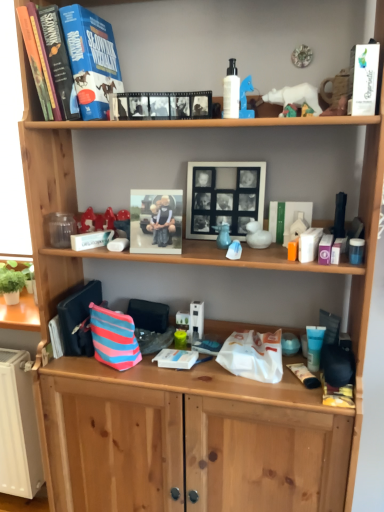
Question: Does hardcover book at upper left, positioned as the second paperback book in front-to-back order, lie behind matte plastic photo frame at center, arranged as the second picture frame when viewed from the right?

Choices:
 (A) no
 (B) yes

Answer: (A)

Question: Can you see hardcover book at upper left, positioned as the second paperback book in front-to-back order, touching matte plastic photo frame at center, which appears as the 1th picture frame when viewed from the left?

Choices:
 (A) no
 (B) yes

Answer: (A)

Question: From the image's perspective, is hardcover book at upper left, positioned as the second paperback book in front-to-back order, located beneath matte plastic photo frame at center, which appears as the 1th picture frame when viewed from the left?

Choices:
 (A) no
 (B) yes

Answer: (A)

Question: Considering the relative positions of hardcover book at upper left, the second paperback book positioned from the right, and matte plastic photo frame at center, which appears as the 1th picture frame when viewed from the left, in the image provided, is hardcover book at upper left, the second paperback book positioned from the right, in front of matte plastic photo frame at center, which appears as the 1th picture frame when viewed from the left,?

Choices:
 (A) no
 (B) yes

Answer: (B)

Question: Considering the relative positions of hardcover book at upper left, positioned as the second paperback book in front-to-back order, and matte plastic photo frame at center, which appears as the 1th picture frame when viewed from the left, in the image provided, is hardcover book at upper left, positioned as the second paperback book in front-to-back order, to the left of matte plastic photo frame at center, which appears as the 1th picture frame when viewed from the left, from the viewer's perspective?

Choices:
 (A) no
 (B) yes

Answer: (B)

Question: Looking at the image, does green matte book at center-right, the first book in the right-to-left sequence, seem bigger or smaller compared to matte plastic photo frame at center, which appears as the 1th picture frame when viewed from the left?

Choices:
 (A) small
 (B) big

Answer: (A)

Question: Visually, is green matte book at center-right, the first book in the back-to-front sequence, positioned to the left or to the right of matte plastic photo frame at center, which appears as the 1th picture frame when viewed from the left?

Choices:
 (A) right
 (B) left

Answer: (A)

Question: Relative to matte plastic photo frame at center, arranged as the second picture frame when viewed from the right, is green matte book at center-right, the second book viewed from the front, in front or behind?

Choices:
 (A) behind
 (B) front

Answer: (A)

Question: Is point (286, 238) closer or farther from the camera than point (180, 225)?

Choices:
 (A) farther
 (B) closer

Answer: (A)

Question: Is white paper at upper right, which ranks as the 2th paperback book in back-to-front order, to the left or to the right of black matte picture frame at center, the 2th picture frame viewed from the left, in the image?

Choices:
 (A) right
 (B) left

Answer: (A)

Question: From their relative heights in the image, would you say white paper at upper right, which appears as the 1th paperback book when viewed from the front, is taller or shorter than black matte picture frame at center, which is the 1th picture frame in right-to-left order?

Choices:
 (A) short
 (B) tall

Answer: (A)

Question: Looking at their shapes, would you say white paper at upper right, which appears as the 1th paperback book when viewed from the front, is wider or thinner than black matte picture frame at center, the 2th picture frame viewed from the left?

Choices:
 (A) thin
 (B) wide

Answer: (A)

Question: From a real-world perspective, is white paper at upper right, the first paperback book when ordered from right to left, physically located above or below black matte picture frame at center, the 2th picture frame viewed from the left?

Choices:
 (A) below
 (B) above

Answer: (B)

Question: Considering the positions of matte plastic photo frame at center, arranged as the second picture frame when viewed from the right, and matte plastic container at middle right, which is the 2th toiletry from back to front, in the image, is matte plastic photo frame at center, arranged as the second picture frame when viewed from the right, bigger or smaller than matte plastic container at middle right, which is the 2th toiletry from back to front,?

Choices:
 (A) small
 (B) big

Answer: (B)

Question: Is point [x=178, y=248] closer or farther from the camera than point [x=321, y=243]?

Choices:
 (A) closer
 (B) farther

Answer: (B)